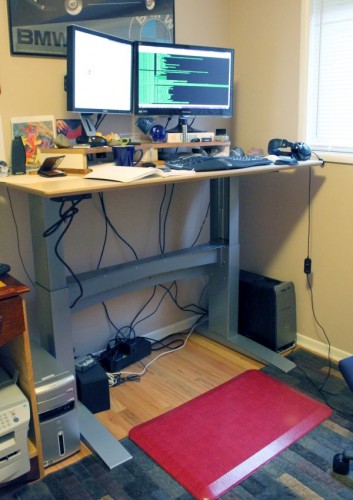
You are a GUI agent. You are given a task and a screenshot of the screen. Output one action in this format:
    pyautogui.click(x=<x>, y=<y>)
    Task: Click on the poster with bmw car on wall
    
    Given the screenshot: What is the action you would take?
    pyautogui.click(x=105, y=12)